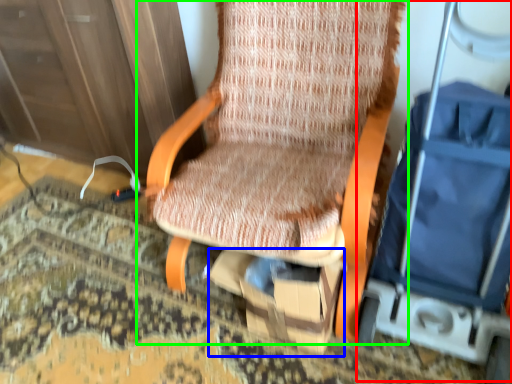
Question: Which object is positioned closest to baby carriage (highlighted by a red box)? Select from cardboard box (highlighted by a blue box) and chair (highlighted by a green box).

Choices:
 (A) cardboard box
 (B) chair

Answer: (A)